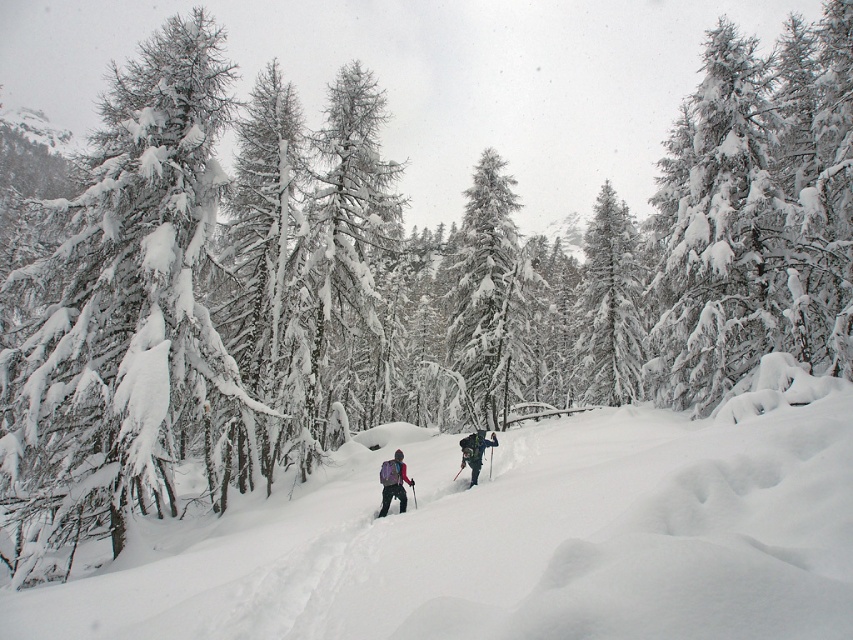
Between white fluffy snow at center and snow-covered evergreen tree at center, which one appears on the right side from the viewer's perspective?

snow-covered evergreen tree at center is more to the right.

Is white fluffy snow at center shorter than snow-covered evergreen tree at center?

Yes, white fluffy snow at center is shorter than snow-covered evergreen tree at center.

Is point (683, 625) positioned before point (511, 328)?

Yes, it is in front of point (511, 328).

Image resolution: width=853 pixels, height=640 pixels. In order to click on white fluffy snow at center in this screenshot , I will do `click(511, 541)`.

Which is below, white fluffy snow at center or matte pink jacket at center?

Positioned lower is matte pink jacket at center.

Is point (143, 604) closer to camera compared to point (387, 500)?

Yes, it is.

The height and width of the screenshot is (640, 853). I want to click on white fluffy snow at center, so click(511, 541).

In the scene shown: Who is positioned more to the right, snow-covered evergreen tree at center or green matte tree at center?

From the viewer's perspective, green matte tree at center appears more on the right side.

The image size is (853, 640). What are the coordinates of `snow-covered evergreen tree at center` in the screenshot? It's located at (490, 296).